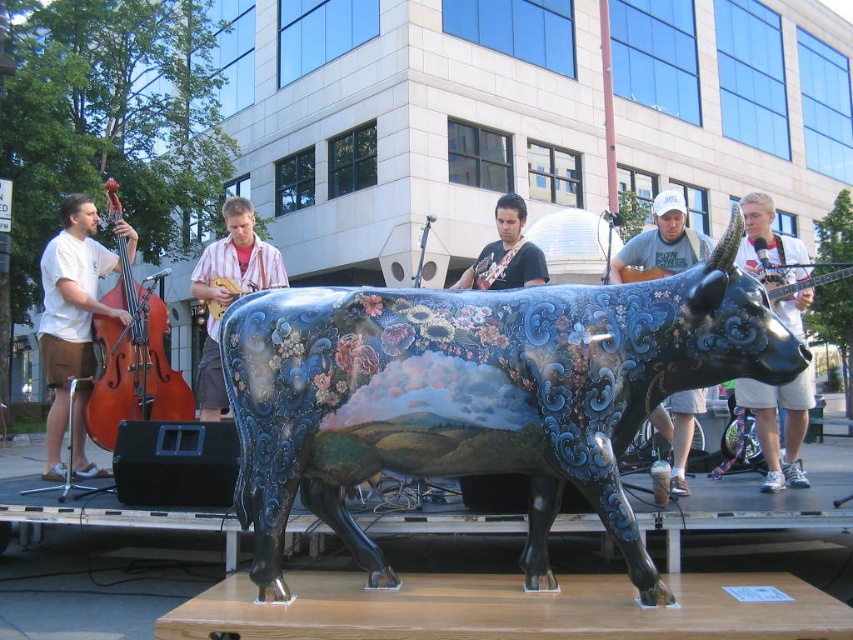
Question: From the image, what is the correct spatial relationship of white cotton shirt at upper right in relation to wooden violin at center?

Choices:
 (A) left
 (B) right

Answer: (B)

Question: Can you confirm if white cotton shirt at upper right is smaller than wooden violin at center?

Choices:
 (A) yes
 (B) no

Answer: (B)

Question: Estimate the real-world distances between objects in this image. Which object is farther from the matte brown shorts at left?

Choices:
 (A) white cap at upper center
 (B) wooden violin at center
 (C) white cotton shirt at upper right

Answer: (C)

Question: Based on their relative distances, which object is farther from the brown wooden cello at left?

Choices:
 (A) matte brown shorts at left
 (B) wooden violin at center
 (C) glossy painted cow at center
 (D) shiny black guitar at center

Answer: (C)

Question: Is striped shirt at center to the left of shiny black guitar at center from the viewer's perspective?

Choices:
 (A) yes
 (B) no

Answer: (A)

Question: Which object is closer to the camera taking this photo?

Choices:
 (A) striped shirt at center
 (B) shiny black guitar at center
 (C) matte brown shorts at left
 (D) glossy painted cow at center

Answer: (D)